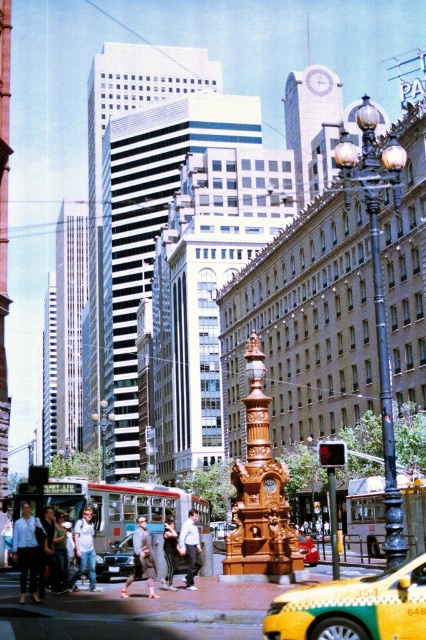
Question: Among these points, which one is nearest to the camera?

Choices:
 (A) (189, 548)
 (B) (129, 540)

Answer: (A)

Question: Is light blue shirt at lower left positioned behind light gray fabric coat at center?

Choices:
 (A) no
 (B) yes

Answer: (A)

Question: Among these objects, which one is nearest to the camera?

Choices:
 (A) gold ornate clock at center
 (B) light gray fabric coat at center
 (C) metallic red car at center

Answer: (B)

Question: Does metallic silver car at center have a lesser width compared to black pants at center?

Choices:
 (A) yes
 (B) no

Answer: (B)

Question: Which object is farther from the camera taking this photo?

Choices:
 (A) metallic silver car at center
 (B) light gray fabric coat at center

Answer: (A)

Question: Is light gray fabric coat at center smaller than metallic silver car at center?

Choices:
 (A) yes
 (B) no

Answer: (B)